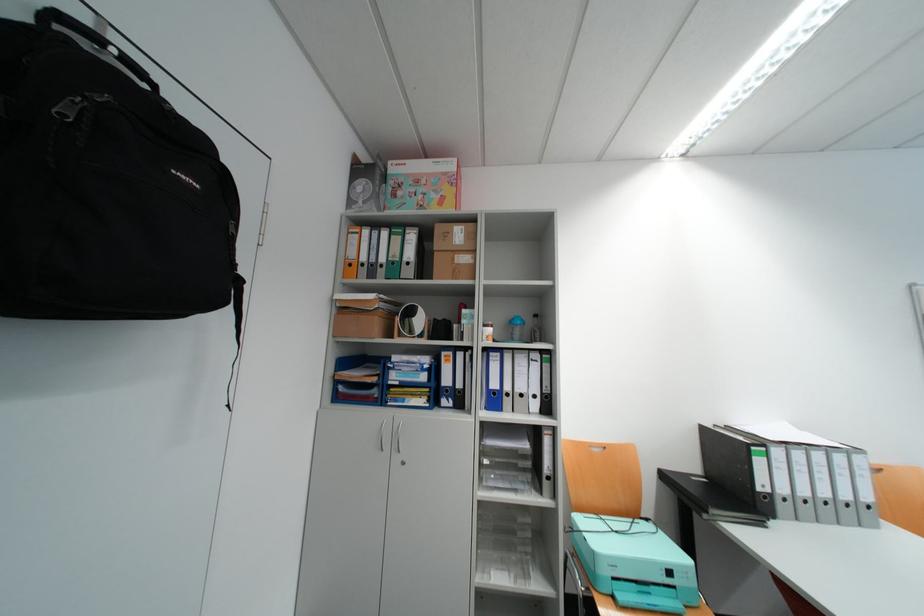
Find where to lift the black backpack handle. Please return your answer as a coordinate pair (x, y).

(91, 39)